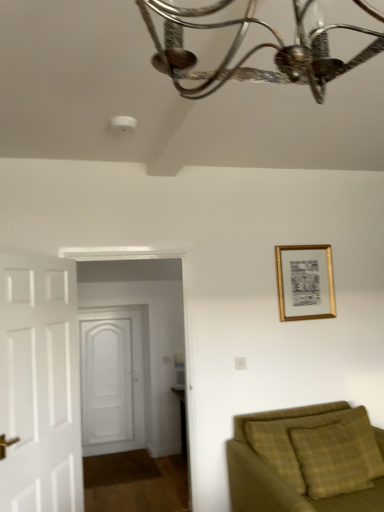
Question: Considering the relative sizes of gold metallic picture frame at upper right and white wooden door at left, which ranks as the 1th door in front-to-back order, in the image provided, is gold metallic picture frame at upper right shorter than white wooden door at left, which ranks as the 1th door in front-to-back order,?

Choices:
 (A) no
 (B) yes

Answer: (B)

Question: Does gold metallic picture frame at upper right have a smaller size compared to white wooden door at left, which ranks as the 1th door in front-to-back order?

Choices:
 (A) no
 (B) yes

Answer: (B)

Question: Can you confirm if gold metallic picture frame at upper right is wider than white wooden door at left, acting as the 2th door starting from the back?

Choices:
 (A) no
 (B) yes

Answer: (A)

Question: Is gold metallic picture frame at upper right next to white wooden door at left, which ranks as the 1th door in front-to-back order, and touching it?

Choices:
 (A) no
 (B) yes

Answer: (A)

Question: Is white wooden door at left, which ranks as the 1th door in front-to-back order, completely or partially inside gold metallic picture frame at upper right?

Choices:
 (A) no
 (B) yes

Answer: (A)

Question: Do you think white wooden door at left, acting as the 2th door starting from the back, is within gold metallic picture frame at upper right, or outside of it?

Choices:
 (A) inside
 (B) outside

Answer: (B)

Question: Considering the positions of white wooden door at left, which ranks as the 1th door in front-to-back order, and gold metallic picture frame at upper right in the image, is white wooden door at left, which ranks as the 1th door in front-to-back order, wider or thinner than gold metallic picture frame at upper right?

Choices:
 (A) wide
 (B) thin

Answer: (A)

Question: Does point (79, 504) appear closer or farther from the camera than point (289, 263)?

Choices:
 (A) farther
 (B) closer

Answer: (B)

Question: In terms of height, does white wooden door at left, which ranks as the 1th door in front-to-back order, look taller or shorter compared to gold metallic picture frame at upper right?

Choices:
 (A) tall
 (B) short

Answer: (A)

Question: From a real-world perspective, is gold metallic picture frame at upper right above or below white wooden door at center, which is the 2th door from front to back?

Choices:
 (A) above
 (B) below

Answer: (A)

Question: Do you think gold metallic picture frame at upper right is within white wooden door at center, which is the 2th door from front to back, or outside of it?

Choices:
 (A) outside
 (B) inside

Answer: (A)

Question: In terms of height, does gold metallic picture frame at upper right look taller or shorter compared to white wooden door at center, marked as the first door in a back-to-front arrangement?

Choices:
 (A) tall
 (B) short

Answer: (B)

Question: From the image's perspective, is gold metallic picture frame at upper right above or below white wooden door at center, marked as the first door in a back-to-front arrangement?

Choices:
 (A) below
 (B) above

Answer: (B)

Question: From the image's perspective, is gold metallic picture frame at upper right positioned above or below white wooden door at left, which ranks as the 1th door in front-to-back order?

Choices:
 (A) below
 (B) above

Answer: (B)

Question: Considering the positions of point (284, 275) and point (71, 498), is point (284, 275) closer or farther from the camera than point (71, 498)?

Choices:
 (A) farther
 (B) closer

Answer: (A)